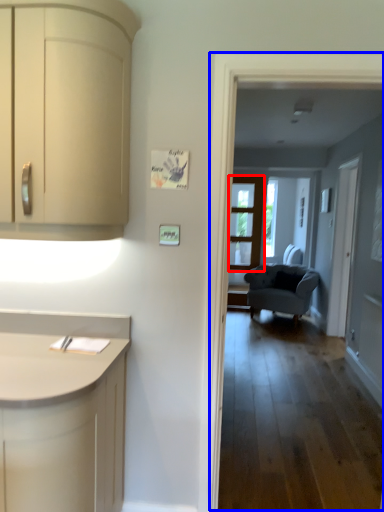
Question: Which of the following is the farthest to the observer, door (highlighted by a red box) or corridor (highlighted by a blue box)?

Choices:
 (A) door
 (B) corridor

Answer: (A)